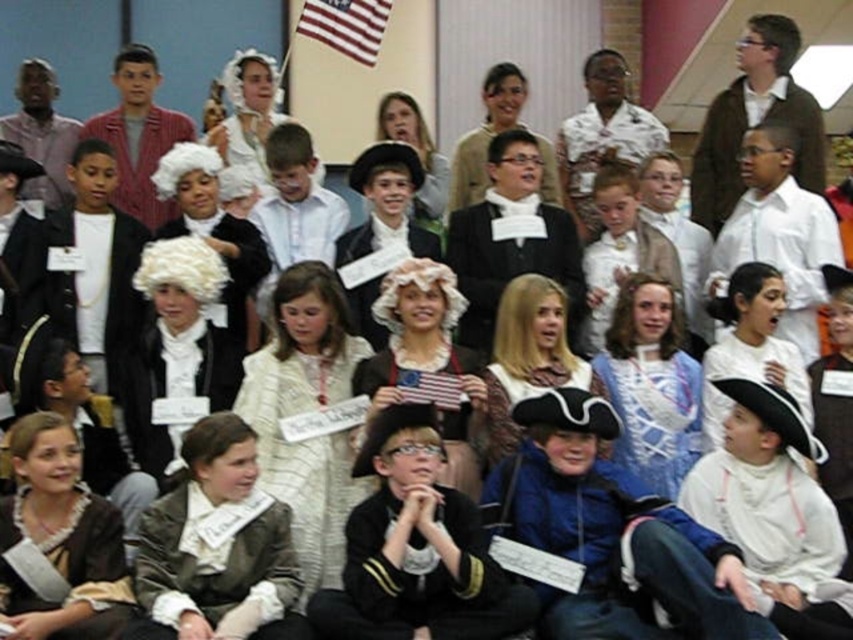
You are a photographer standing at the back of the auditorium. You want to take a photo of the white textured dress at center and the american flag at center. How far apart are these two items in the image?

The white textured dress at center is 5.25 meters away from the american flag at center.

You are a photographer positioned at the back of the auditorium. You need to capture a photo of both the matte brown jacket at center and the american flag at upper center without any obstruction. Based on their heights, which object should you focus on first to ensure both are visible?

The matte brown jacket at center is taller than the american flag at upper center. To ensure both are visible without obstruction, focus on the matte brown jacket at center first, then adjust the camera angle to include the american flag at upper center.